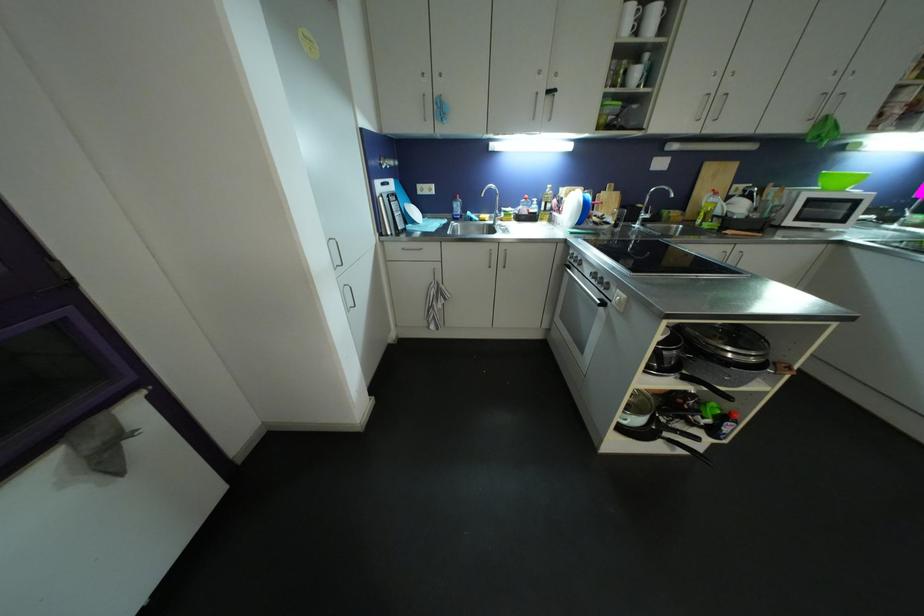
Image resolution: width=924 pixels, height=616 pixels. Find the location of `silver drawer handle`. silver drawer handle is located at coordinates (418, 249).